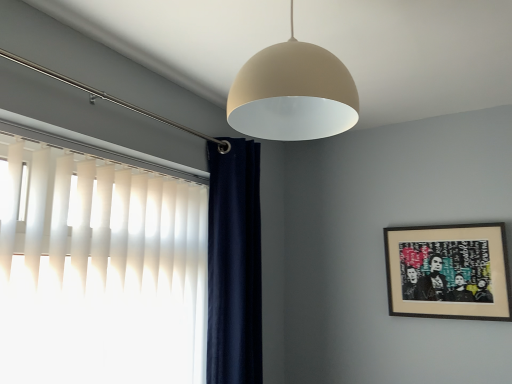
Question: Is wooden framed artwork at right at the back of matte beige dome at upper center?

Choices:
 (A) no
 (B) yes

Answer: (A)

Question: Can you confirm if matte beige dome at upper center is smaller than wooden framed artwork at right?

Choices:
 (A) yes
 (B) no

Answer: (B)

Question: Is matte beige dome at upper center shorter than wooden framed artwork at right?

Choices:
 (A) no
 (B) yes

Answer: (B)

Question: Is matte beige dome at upper center to the right of wooden framed artwork at right from the viewer's perspective?

Choices:
 (A) yes
 (B) no

Answer: (B)

Question: From a real-world perspective, is matte beige dome at upper center located beneath wooden framed artwork at right?

Choices:
 (A) yes
 (B) no

Answer: (B)

Question: In terms of height, does white vertical blinds at left look taller or shorter compared to matte beige dome at upper center?

Choices:
 (A) tall
 (B) short

Answer: (A)

Question: Is white vertical blinds at left in front of or behind matte beige dome at upper center in the image?

Choices:
 (A) behind
 (B) front

Answer: (A)

Question: In the image, is white vertical blinds at left on the left side or the right side of matte beige dome at upper center?

Choices:
 (A) left
 (B) right

Answer: (A)

Question: Is white vertical blinds at left bigger or smaller than matte beige dome at upper center?

Choices:
 (A) big
 (B) small

Answer: (A)

Question: From the image's perspective, is wooden framed artwork at right positioned above or below matte beige dome at upper center?

Choices:
 (A) below
 (B) above

Answer: (A)

Question: From a real-world perspective, is wooden framed artwork at right physically located above or below matte beige dome at upper center?

Choices:
 (A) above
 (B) below

Answer: (B)

Question: Based on their sizes in the image, would you say wooden framed artwork at right is bigger or smaller than matte beige dome at upper center?

Choices:
 (A) small
 (B) big

Answer: (A)

Question: Considering their positions, is wooden framed artwork at right located in front of or behind matte beige dome at upper center?

Choices:
 (A) behind
 (B) front

Answer: (A)

Question: Is wooden framed artwork at right to the left or to the right of white vertical blinds at left in the image?

Choices:
 (A) left
 (B) right

Answer: (B)

Question: From a real-world perspective, relative to white vertical blinds at left, is wooden framed artwork at right vertically above or below?

Choices:
 (A) above
 (B) below

Answer: (A)